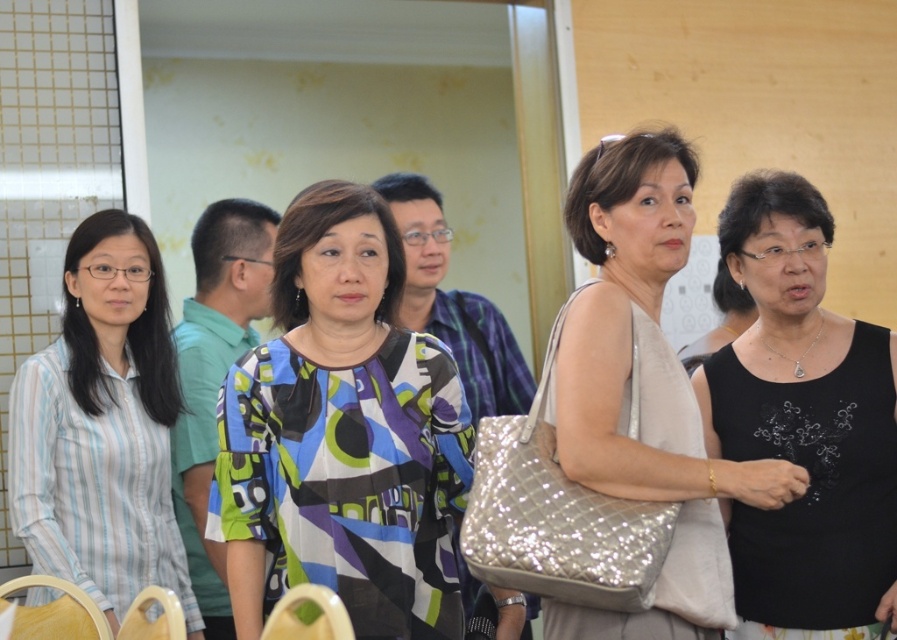
Can you confirm if matte beige purse at center is positioned above blue printed shirt at center?

Indeed, matte beige purse at center is positioned over blue printed shirt at center.

Which is in front, point (662, 384) or point (190, 467)?

Point (662, 384) is more forward.

Is point (642, 435) positioned behind point (212, 278)?

No, it is in front of (212, 278).

Find the location of `matte beige purse at center`. matte beige purse at center is located at coordinates (645, 390).

Does black matte tank top at center appear over printed fabric shirt at center?

Incorrect, black matte tank top at center is not positioned above printed fabric shirt at center.

In order to click on black matte tank top at center in this screenshot , I will do `click(803, 424)`.

You are a GUI agent. You are given a task and a screenshot of the screen. Output one action in this format:
    pyautogui.click(x=<x>, y=<y>)
    Task: Click on the black matte tank top at center
    
    Given the screenshot: What is the action you would take?
    pyautogui.click(x=803, y=424)

You are a GUI agent. You are given a task and a screenshot of the screen. Output one action in this format:
    pyautogui.click(x=<x>, y=<y>)
    Task: Click on the black matte tank top at center
    
    Given the screenshot: What is the action you would take?
    pyautogui.click(x=803, y=424)

Does point (785, 364) lie in front of point (140, 532)?

Yes, it is in front of point (140, 532).

Can you confirm if black matte tank top at center is thinner than light blue striped shirt at left?

Yes, black matte tank top at center is thinner than light blue striped shirt at left.

At what (x,y) coordinates should I click in order to perform the action: click on black matte tank top at center. Please return your answer as a coordinate pair (x, y). Looking at the image, I should click on (803, 424).